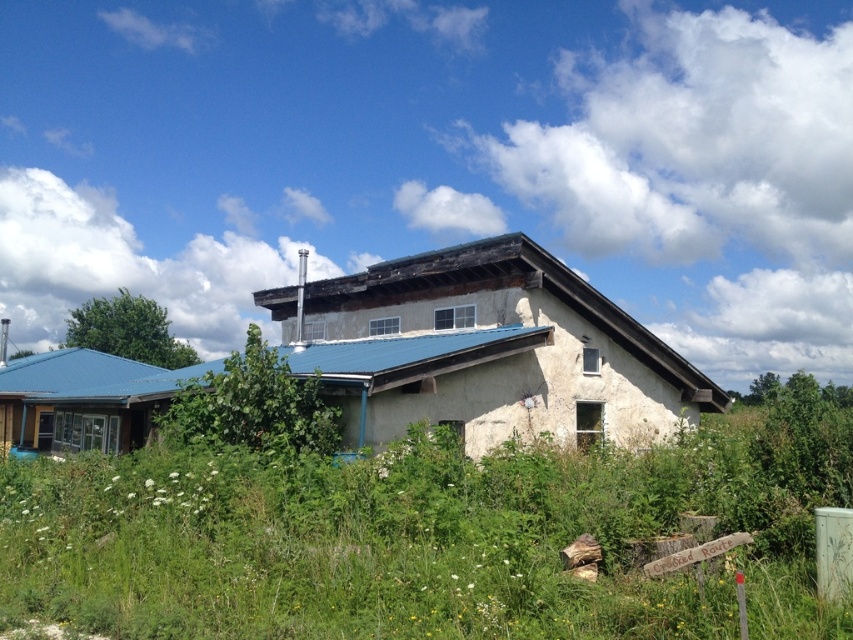
Question: Which object appears farthest from the camera in this image?

Choices:
 (A) green grass at center
 (B) stucco house at center

Answer: (B)

Question: Observing the image, what is the correct spatial positioning of green grass at center in reference to matte blue siding at left?

Choices:
 (A) below
 (B) above

Answer: (A)

Question: Which of the following is the farthest from the observer?

Choices:
 (A) stucco house at center
 (B) matte blue siding at left

Answer: (B)

Question: Which point is farther to the camera?

Choices:
 (A) (396, 508)
 (B) (86, 356)
 (C) (552, 276)

Answer: (B)

Question: Is stucco house at center closer to the viewer compared to matte blue siding at left?

Choices:
 (A) no
 (B) yes

Answer: (B)

Question: Considering the relative positions of stucco house at center and matte blue siding at left in the image provided, where is stucco house at center located with respect to matte blue siding at left?

Choices:
 (A) right
 (B) left

Answer: (A)